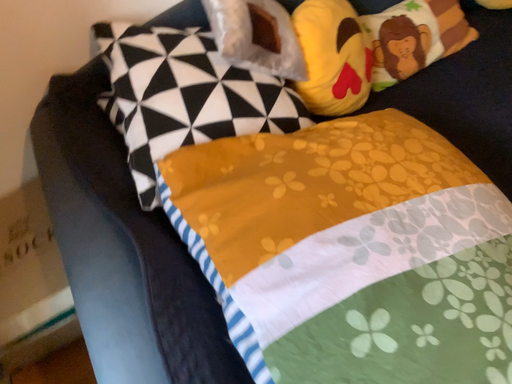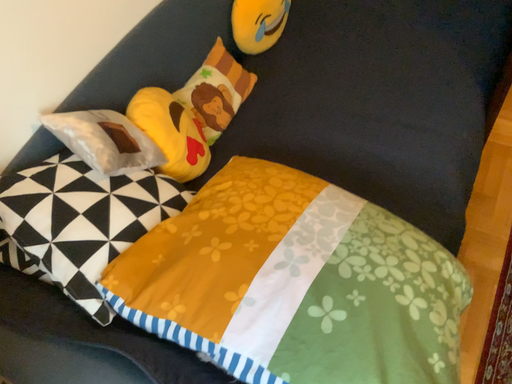
Question: Which way did the camera rotate in the video?

Choices:
 (A) rotated left
 (B) rotated right

Answer: (B)